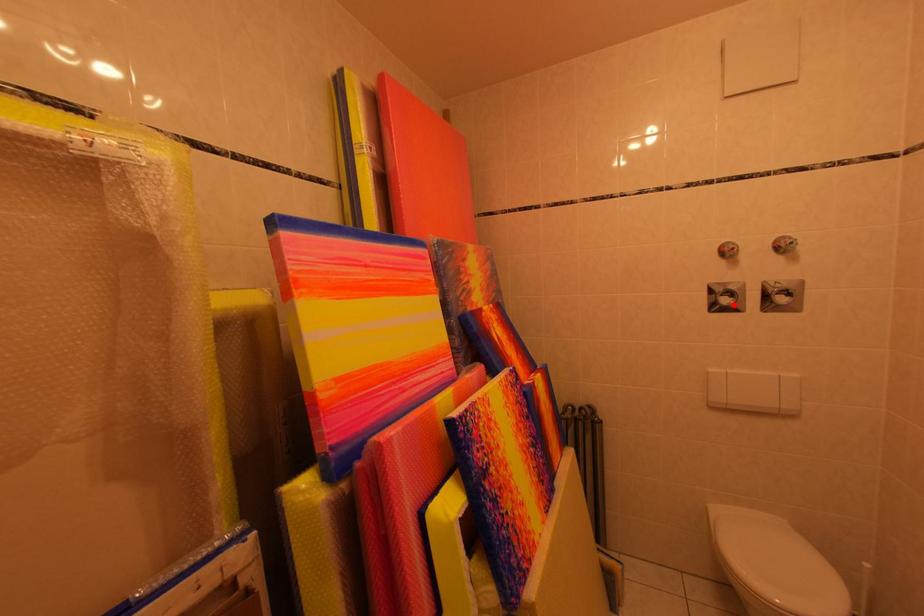
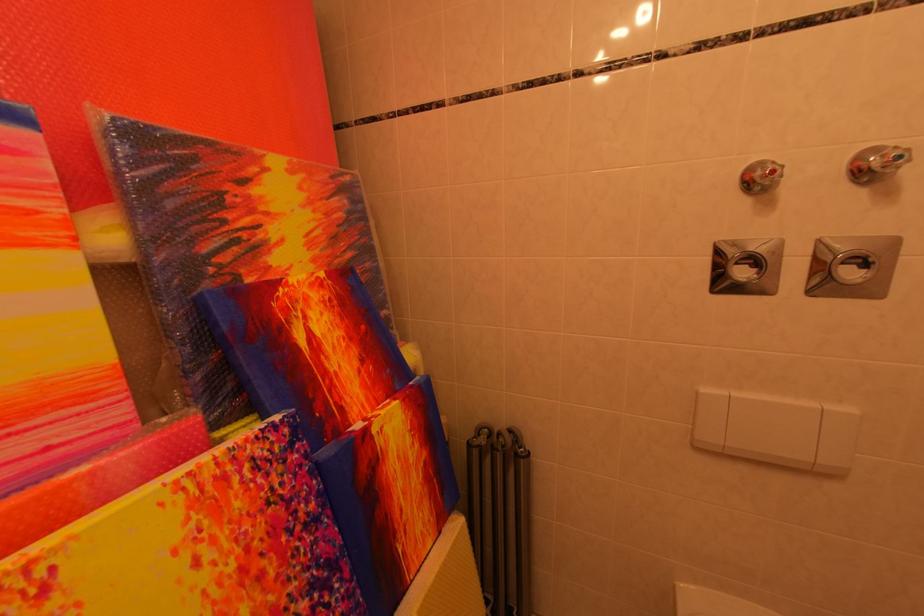
Where in the second image is the point corresponding to the highlighted location from the first image?

(751, 277)